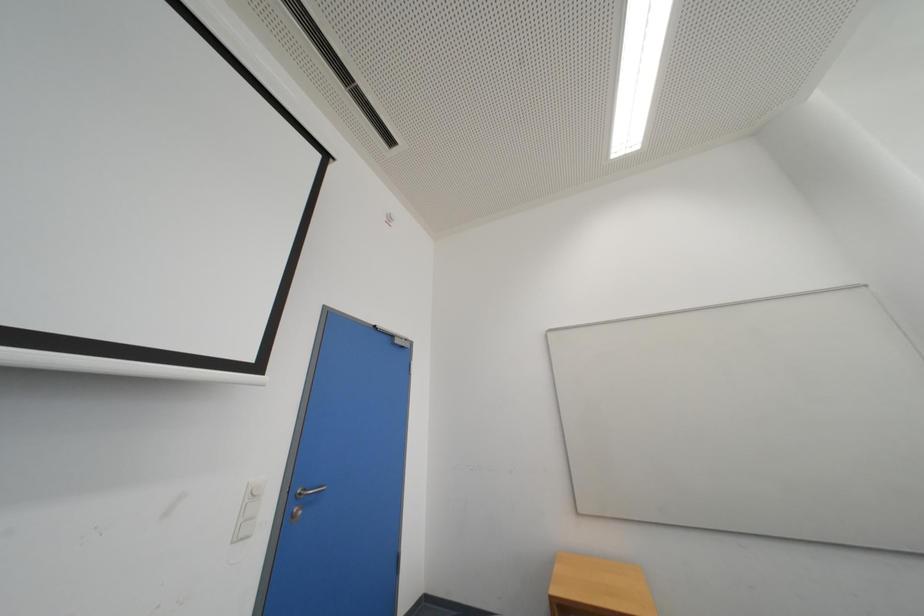
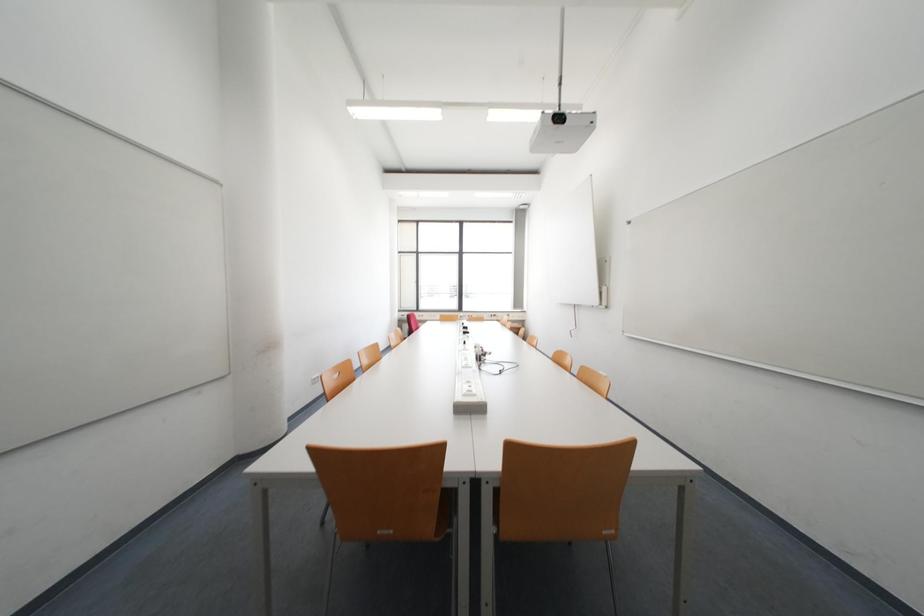
Question: The images are taken continuously from a first-person perspective. In which direction is your viewpoint rotating?

Choices:
 (A) Left
 (B) Right
 (C) Up
 (D) Down

Answer: (B)